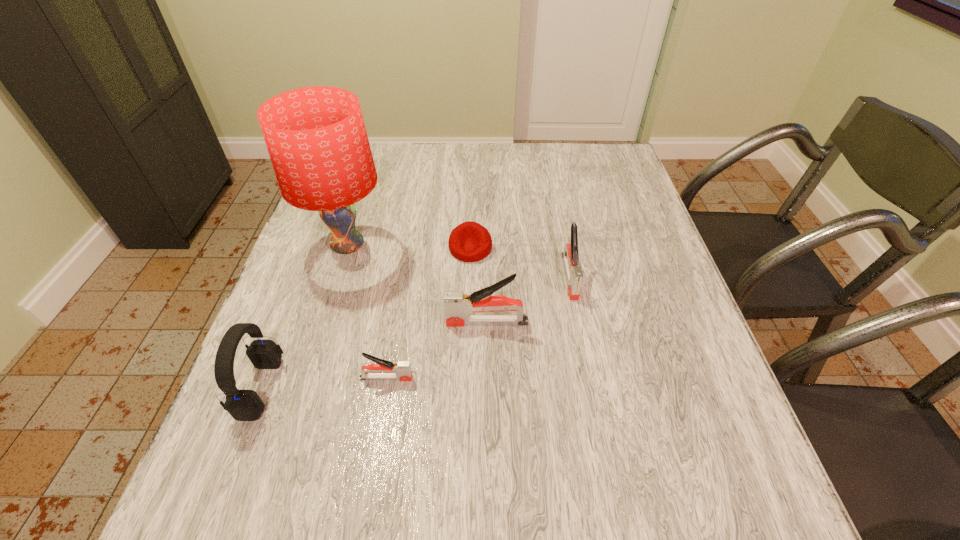
Locate an element on the screen. the leftmost stapler is located at coordinates coord(401,370).

At what (x,y) coordinates should I click in order to perform the action: click on the nearest stapler. Please return your answer as a coordinate pair (x, y). This screenshot has height=540, width=960. Looking at the image, I should click on (401, 370).

Identify the location of the second stapler from right to left. The image size is (960, 540). (458, 305).

Where is `the second farthest stapler`? The height and width of the screenshot is (540, 960). the second farthest stapler is located at coordinates (458, 305).

The image size is (960, 540). Find the location of `the second shortest stapler`. the second shortest stapler is located at coordinates (574, 274).

Locate an element on the screen. This screenshot has height=540, width=960. the farthest stapler is located at coordinates (574, 274).

Identify the location of the tallest object. (316, 138).

Find the location of `beanbag`. beanbag is located at coordinates (469, 242).

Locate an element on the screen. headset is located at coordinates (x=243, y=405).

I want to click on free spot located 0.220m on the handle side of the shortest stapler, so click(526, 378).